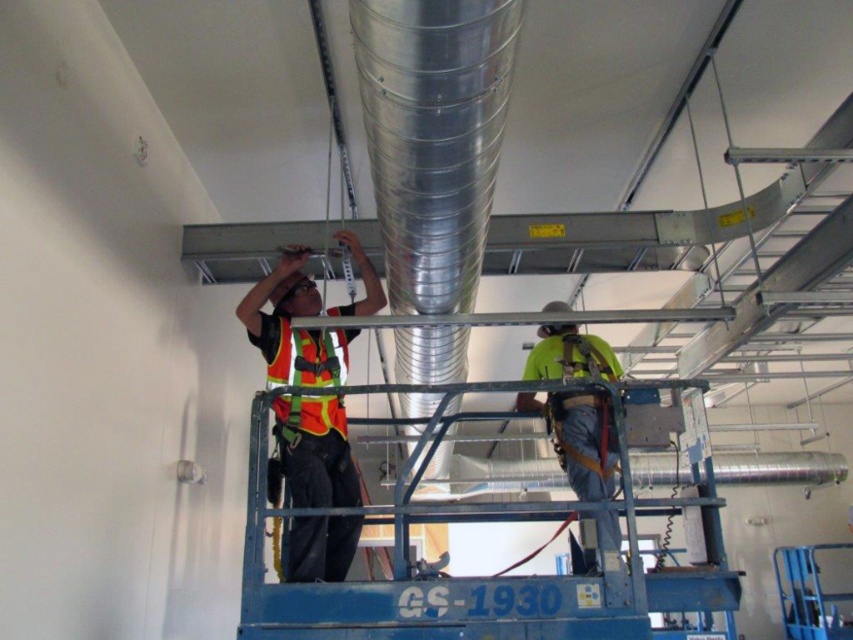
Can you confirm if reflective orange safety vest at center is thinner than reflective fabric safety vest at center?

Incorrect, reflective orange safety vest at center's width is not less than reflective fabric safety vest at center's.

Is reflective orange safety vest at center bigger than reflective fabric safety vest at center?

Indeed, reflective orange safety vest at center has a larger size compared to reflective fabric safety vest at center.

Image resolution: width=853 pixels, height=640 pixels. What do you see at coordinates (293, 326) in the screenshot?
I see `reflective orange safety vest at center` at bounding box center [293, 326].

I want to click on reflective orange safety vest at center, so click(293, 326).

What do you see at coordinates (579, 438) in the screenshot? I see `yellow-green reflective safety vest at center` at bounding box center [579, 438].

Is yellow-green reflective safety vest at center smaller than reflective fabric safety vest at center?

Actually, yellow-green reflective safety vest at center might be larger than reflective fabric safety vest at center.

This screenshot has height=640, width=853. In order to click on yellow-green reflective safety vest at center in this screenshot , I will do `click(579, 438)`.

Find the location of a particular element. The height and width of the screenshot is (640, 853). yellow-green reflective safety vest at center is located at coordinates (579, 438).

Can you confirm if reflective orange safety vest at center is taller than yellow-green reflective safety vest at center?

Correct, reflective orange safety vest at center is much taller as yellow-green reflective safety vest at center.

Is point (312, 460) more distant than point (572, 330)?

No, (312, 460) is closer to viewer.

Image resolution: width=853 pixels, height=640 pixels. In order to click on reflective orange safety vest at center in this screenshot , I will do `click(293, 326)`.